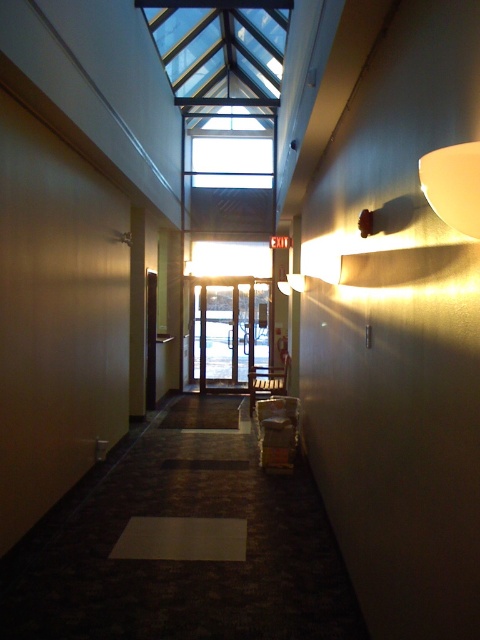
Locate an element on the screen. The width and height of the screenshot is (480, 640). transparent glass elevator at center is located at coordinates (228, 332).

Is transparent glass elevator at center taller than matte white sconce at upper right?

Correct, transparent glass elevator at center is much taller as matte white sconce at upper right.

I want to click on transparent glass elevator at center, so click(x=228, y=332).

The image size is (480, 640). Find the location of `transparent glass elevator at center`. transparent glass elevator at center is located at coordinates (228, 332).